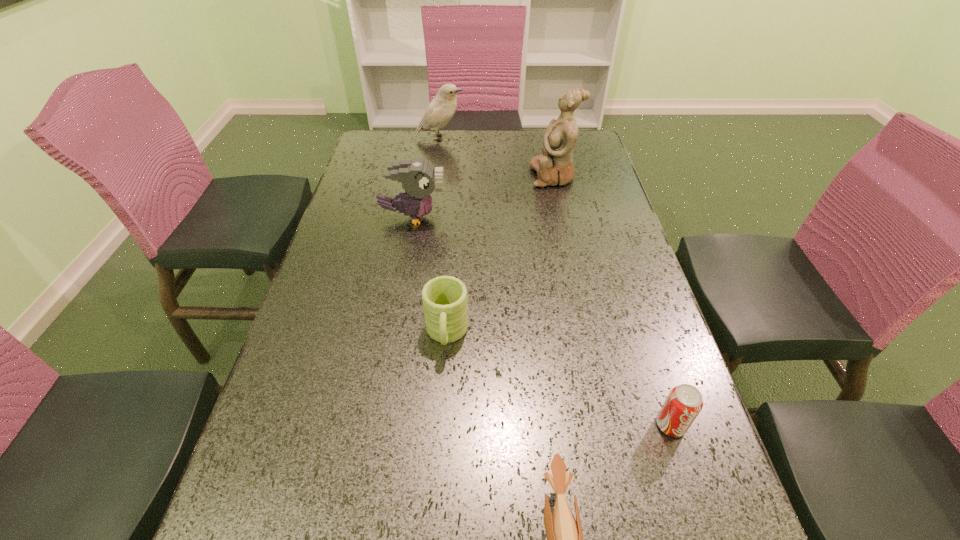
Where is `vacant space positioned at the beak of the farthest object`? The width and height of the screenshot is (960, 540). vacant space positioned at the beak of the farthest object is located at coordinates (519, 138).

Image resolution: width=960 pixels, height=540 pixels. I want to click on vacant space located 0.140m at the beak of the second nearest bird, so point(494,217).

What are the coordinates of `free location located 0.180m on the side of the mug with the handle` in the screenshot? It's located at tap(439, 446).

Where is `free space located 0.110m on the logo side of the soda can`? The height and width of the screenshot is (540, 960). free space located 0.110m on the logo side of the soda can is located at coordinates (696, 504).

Identify the location of figurine that is at the far edge. (555, 167).

Locate an element on the screen. This screenshot has height=540, width=960. bird situated at the far edge is located at coordinates (442, 108).

Where is `object positioned at the left edge`? object positioned at the left edge is located at coordinates (419, 178).

Identify the location of figurine positioned at the right edge. This screenshot has width=960, height=540. (555, 167).

Find the location of a particular element. The image size is (960, 540). soda can present at the right edge is located at coordinates (684, 402).

Find the location of a particular element. This screenshot has height=540, width=960. object at the far right corner is located at coordinates click(x=555, y=167).